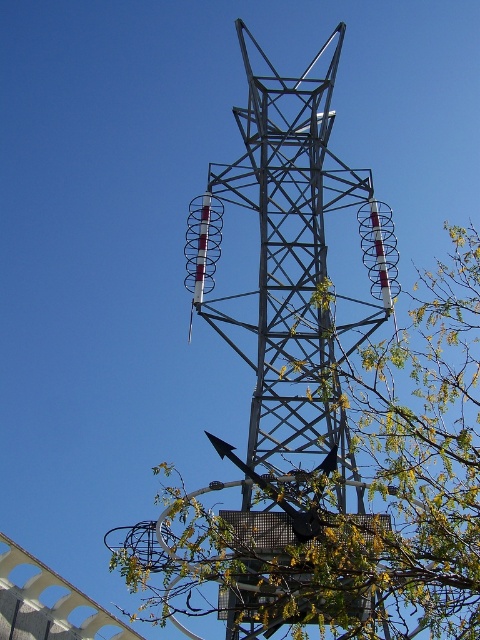
Question: Which object is closer to the camera taking this photo?

Choices:
 (A) metallic structure at center
 (B) green leafy tree at center

Answer: (B)

Question: Among these objects, which one is nearest to the camera?

Choices:
 (A) green leafy tree at center
 (B) metallic structure at center

Answer: (A)

Question: Does green leafy tree at center lie in front of metallic structure at center?

Choices:
 (A) no
 (B) yes

Answer: (B)

Question: Is green leafy tree at center closer to the viewer compared to metallic structure at center?

Choices:
 (A) yes
 (B) no

Answer: (A)

Question: Which point is farther to the camera?

Choices:
 (A) (463, 371)
 (B) (252, 202)

Answer: (B)

Question: Where is green leafy tree at center located in relation to metallic structure at center in the image?

Choices:
 (A) above
 (B) below

Answer: (B)